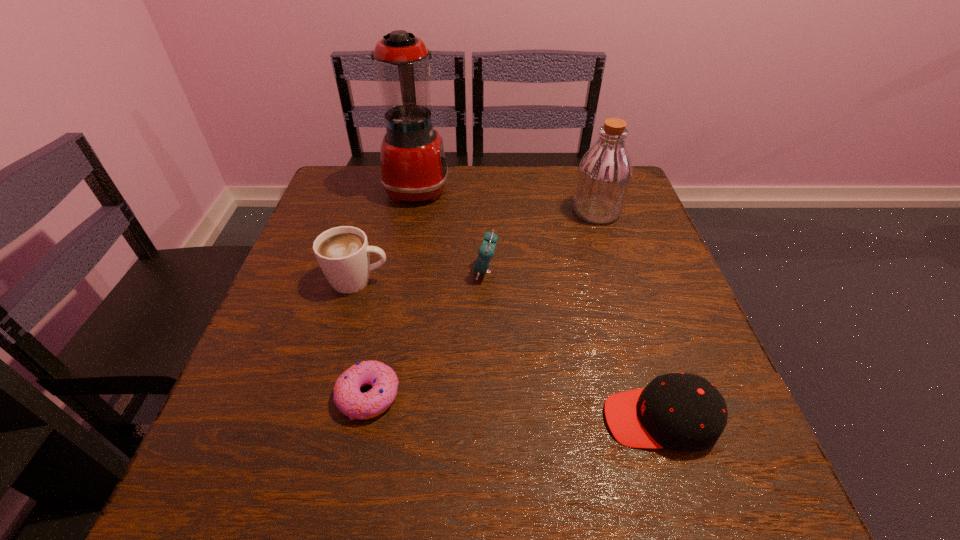
Image resolution: width=960 pixels, height=540 pixels. I want to click on vacant space in between the second shortest object and the alarm clock, so click(573, 346).

Identify the location of vacant point located between the cappuccino and the shortest object. (363, 338).

The width and height of the screenshot is (960, 540). I want to click on vacant area between the doughnut and the bottle, so click(483, 303).

Find the location of `free spot between the cap and the shortest object`. free spot between the cap and the shortest object is located at coordinates (515, 408).

Where is `vacant point located between the bottle and the cap`? vacant point located between the bottle and the cap is located at coordinates (628, 315).

The width and height of the screenshot is (960, 540). I want to click on free space between the doughnut and the fifth shortest object, so point(483,303).

Locate an element on the screen. The image size is (960, 540). free space between the cappuccino and the second tallest object is located at coordinates (477, 246).

This screenshot has width=960, height=540. I want to click on free space between the cap and the fourth object from left to right, so click(x=573, y=346).

This screenshot has height=540, width=960. In order to click on vacant region between the bottle and the alarm clock in this screenshot , I will do `click(541, 241)`.

I want to click on vacant space that is in between the cap and the fourth object from left to right, so click(573, 346).